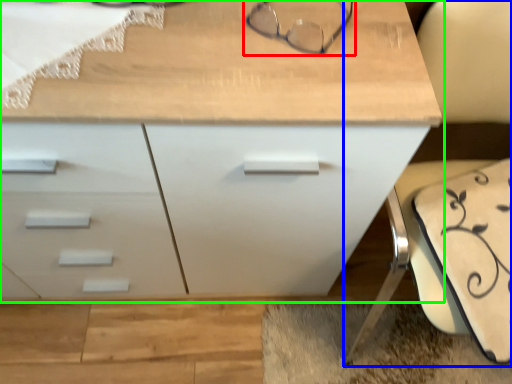
Question: Which object is the closest to the glasses (highlighted by a red box)? Choose among these: swivel chair (highlighted by a blue box) or chest of drawers (highlighted by a green box).

Choices:
 (A) swivel chair
 (B) chest of drawers

Answer: (B)